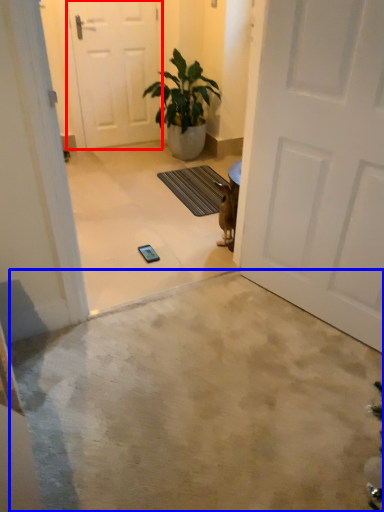
Question: Which object appears closest to the camera in this image, door (highlighted by a red box) or concrete (highlighted by a blue box)?

Choices:
 (A) door
 (B) concrete

Answer: (B)